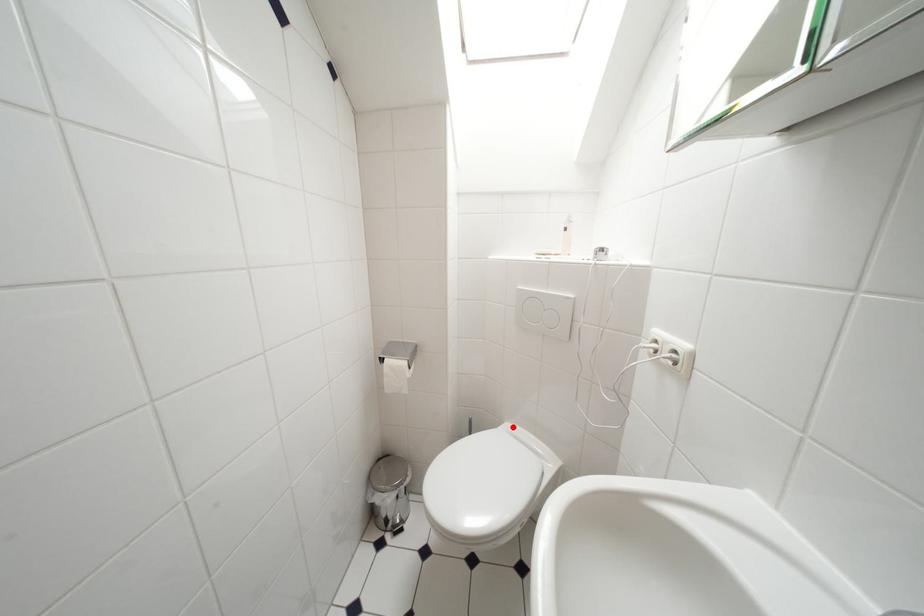
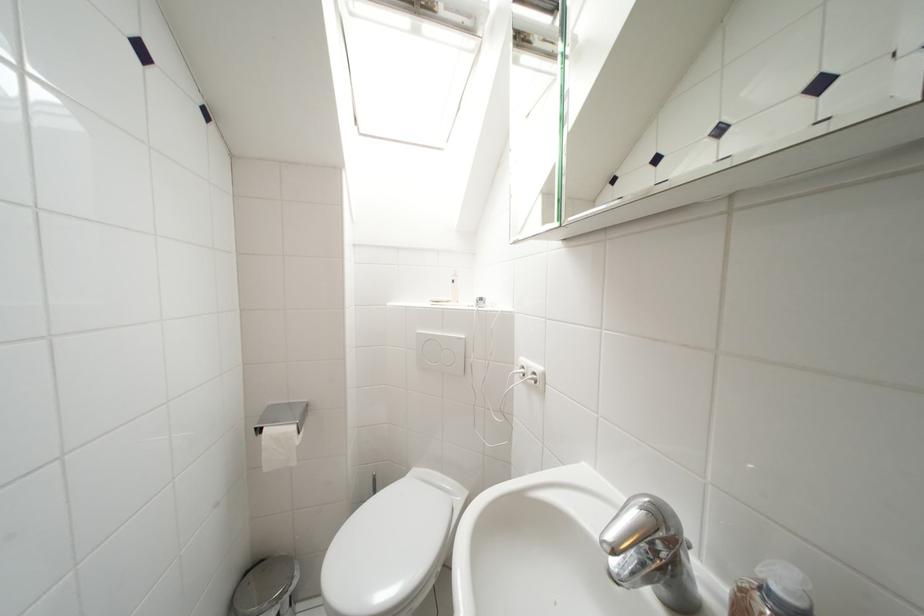
Locate, in the second image, the point that corresponds to the highlighted location in the first image.

(420, 474)